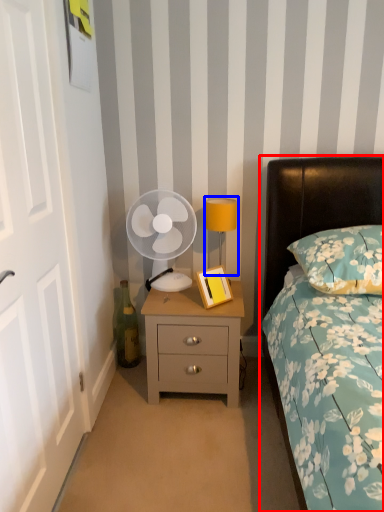
Question: Which object is further to the camera taking this photo, bed (highlighted by a red box) or bedside lamp (highlighted by a blue box)?

Choices:
 (A) bed
 (B) bedside lamp

Answer: (B)